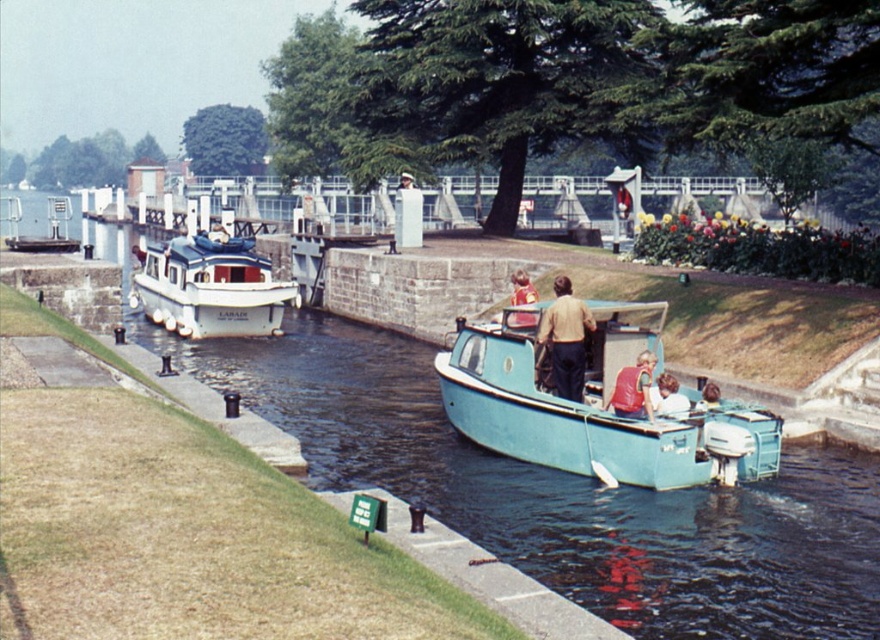
Question: Which object appears closest to the camera in this image?

Choices:
 (A) red fabric shirt at center
 (B) light blue fabric shirt at center
 (C) blue glossy boat at center
 (D) light brown wooden boat at lower right

Answer: (C)

Question: Which object appears closest to the camera in this image?

Choices:
 (A) red fabric shirt at center
 (B) light brown wooden boat at lower right
 (C) blue glossy boat at center

Answer: (C)

Question: Can you confirm if light blue fiberglass boat at center is bigger than red fabric shirt at center?

Choices:
 (A) yes
 (B) no

Answer: (B)

Question: Is blue glossy boat at center to the right of light blue fabric shirt at center from the viewer's perspective?

Choices:
 (A) yes
 (B) no

Answer: (B)

Question: Is blue glossy boat at center positioned in front of light blue fiberglass boat at center?

Choices:
 (A) yes
 (B) no

Answer: (A)

Question: Which of the following is the closest to the observer?

Choices:
 (A) light blue fabric shirt at center
 (B) red life vest at center
 (C) white glossy boat at left
 (D) light brown leather jacket at center

Answer: (B)